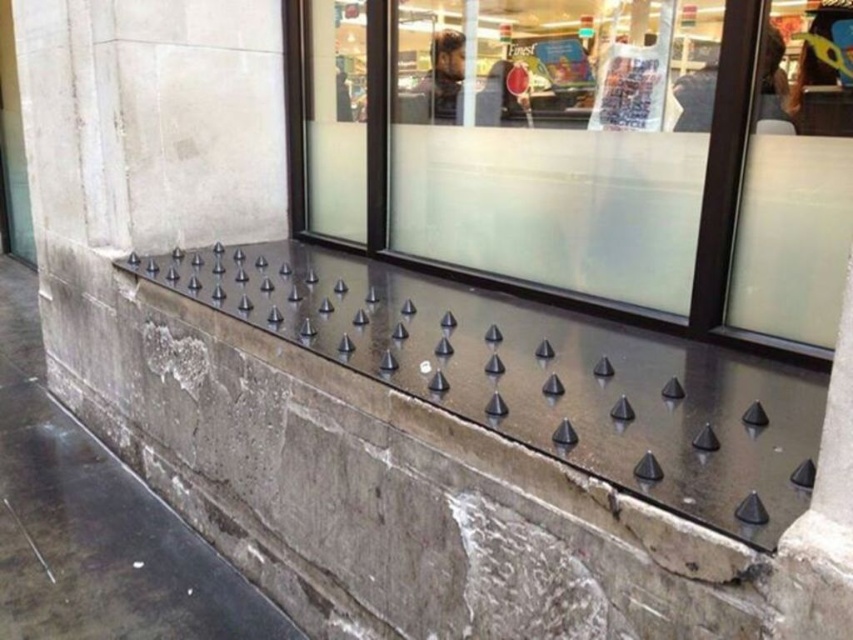
Does transparent glass at center appear on the right side of black rubber spikes at upper center?

Yes, transparent glass at center is to the right of black rubber spikes at upper center.

Between point (585, 294) and point (62, 504), which one is positioned in front?

Point (585, 294) is in front.

The height and width of the screenshot is (640, 853). Identify the location of transparent glass at center. (589, 150).